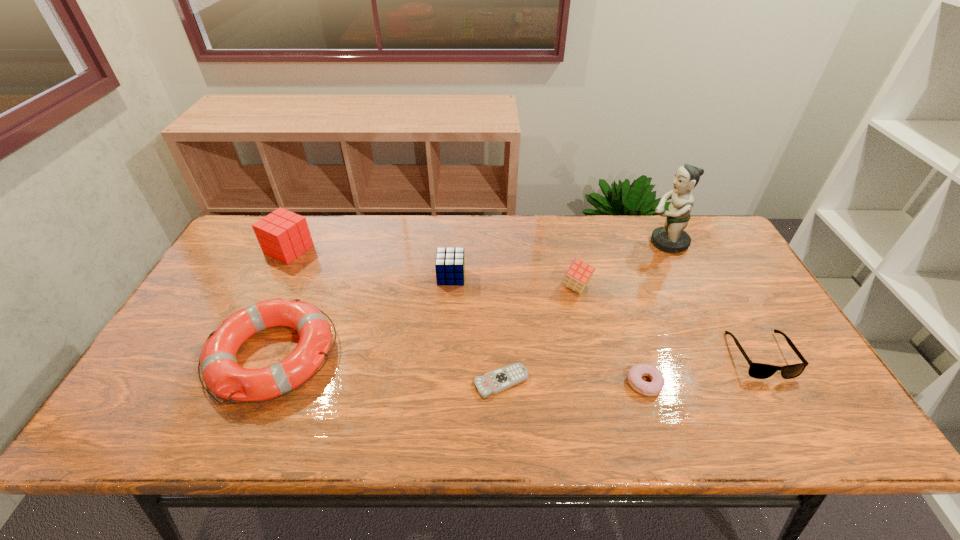
You are a GUI agent. You are given a task and a screenshot of the screen. Output one action in this format:
    pyautogui.click(x=<x>, y=<y>)
    Task: Click on the vacant space located on the left of the shortest object
    The height and width of the screenshot is (540, 960).
    Given the screenshot: What is the action you would take?
    pyautogui.click(x=344, y=382)

Locate an element on the screen. figurine at the far edge is located at coordinates (672, 238).

Identify the location of cube that is positioned at the far edge. Image resolution: width=960 pixels, height=540 pixels. (283, 235).

Find the location of a particular element. The height and width of the screenshot is (540, 960). object present at the near edge is located at coordinates (221, 373).

Locate an element on the screen. cube that is at the left edge is located at coordinates (283, 235).

Where is `life buoy that is at the left edge`? life buoy that is at the left edge is located at coordinates (221, 373).

Find the location of a particular element. The width and height of the screenshot is (960, 540). figurine located in the right edge section of the desktop is located at coordinates (672, 238).

This screenshot has height=540, width=960. Find the location of `sunglasses located in the right edge section of the desktop`. sunglasses located in the right edge section of the desktop is located at coordinates (756, 370).

Where is `object at the far left corner`? object at the far left corner is located at coordinates (283, 235).

At what (x,y) coordinates should I click in order to perform the action: click on object at the near left corner. Please return your answer as a coordinate pair (x, y). This screenshot has width=960, height=540. Looking at the image, I should click on (221, 373).